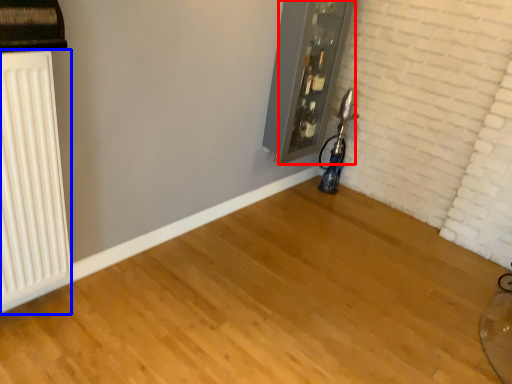
Question: Which of the following is the closest to the observer, window frame (highlighted by a red box) or radiator (highlighted by a blue box)?

Choices:
 (A) window frame
 (B) radiator

Answer: (B)